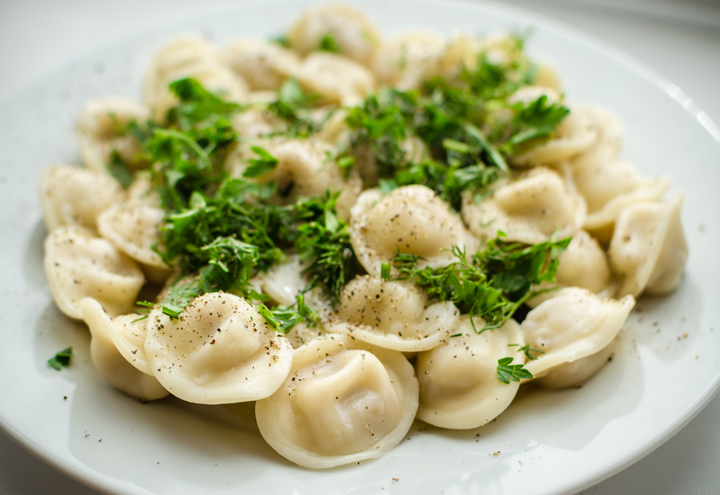
The width and height of the screenshot is (720, 495). Find the location of `white table to bottom right of plate`. white table to bottom right of plate is located at coordinates (695, 479).